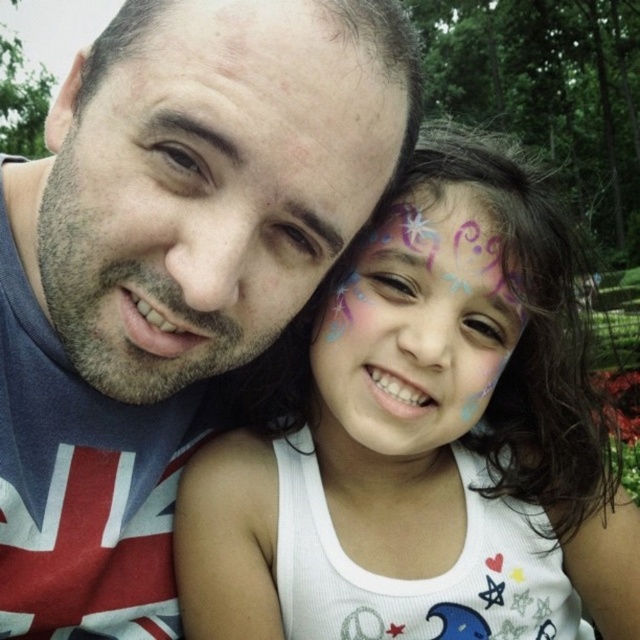
Which is more to the left, matte blue t-shirt at left or white matte face paint at center?

matte blue t-shirt at left

Can you confirm if matte blue t-shirt at left is smaller than white matte face paint at center?

Correct, matte blue t-shirt at left occupies less space than white matte face paint at center.

Measure the distance between matte blue t-shirt at left and camera.

They are 25.36 inches apart.

The width and height of the screenshot is (640, 640). I want to click on matte blue t-shirt at left, so [x=170, y=272].

Who is higher up, matte blue t-shirt at left or pastel painted face at center?

matte blue t-shirt at left is above.

Which of these two, matte blue t-shirt at left or pastel painted face at center, stands shorter?

With less height is pastel painted face at center.

Does point (72, 486) come farther from viewer compared to point (365, 353)?

That is True.

Identify the location of matte blue t-shirt at left. (170, 272).

Who is more forward, (336, 276) or (342, 401)?

Point (336, 276) is in front.

Does point (497, 563) come farther from viewer compared to point (493, 259)?

Yes, point (497, 563) is behind point (493, 259).

Locate an element on the screen. The height and width of the screenshot is (640, 640). white matte face paint at center is located at coordinates (422, 440).